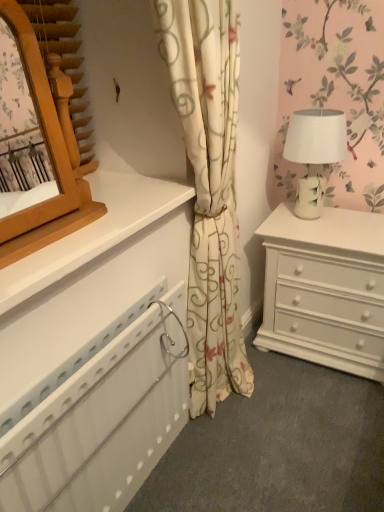
Question: Is white ceramic table lamp at right oriented away from white plastic radiator at lower left?

Choices:
 (A) yes
 (B) no

Answer: (B)

Question: Is white plastic radiator at lower left a part of white ceramic table lamp at right?

Choices:
 (A) no
 (B) yes

Answer: (A)

Question: Is white ceramic table lamp at right closer to the viewer compared to white plastic radiator at lower left?

Choices:
 (A) yes
 (B) no

Answer: (B)

Question: From the image's perspective, is white ceramic table lamp at right located beneath white plastic radiator at lower left?

Choices:
 (A) no
 (B) yes

Answer: (A)

Question: Considering the relative sizes of white ceramic table lamp at right and white plastic radiator at lower left in the image provided, is white ceramic table lamp at right shorter than white plastic radiator at lower left?

Choices:
 (A) no
 (B) yes

Answer: (B)

Question: Considering their positions, is white ceramic table lamp at right located in front of or behind wooden mirror at upper left?

Choices:
 (A) front
 (B) behind

Answer: (B)

Question: From a real-world perspective, is white ceramic table lamp at right physically located above or below wooden mirror at upper left?

Choices:
 (A) below
 (B) above

Answer: (A)

Question: From the image's perspective, relative to wooden mirror at upper left, is white ceramic table lamp at right above or below?

Choices:
 (A) above
 (B) below

Answer: (A)

Question: Is white ceramic table lamp at right wider or thinner than wooden mirror at upper left?

Choices:
 (A) thin
 (B) wide

Answer: (B)

Question: Is white floral curtain at center to the left or to the right of white plastic radiator at lower left in the image?

Choices:
 (A) right
 (B) left

Answer: (A)

Question: Is white floral curtain at center wider or thinner than white plastic radiator at lower left?

Choices:
 (A) thin
 (B) wide

Answer: (B)

Question: Which is correct: white floral curtain at center is inside white plastic radiator at lower left, or outside of it?

Choices:
 (A) outside
 (B) inside

Answer: (A)

Question: Is white floral curtain at center in front of or behind white plastic radiator at lower left in the image?

Choices:
 (A) front
 (B) behind

Answer: (B)

Question: From the image's perspective, is white plastic radiator at lower left located above or below white ceramic table lamp at right?

Choices:
 (A) below
 (B) above

Answer: (A)

Question: Would you say white plastic radiator at lower left is inside or outside white ceramic table lamp at right?

Choices:
 (A) inside
 (B) outside

Answer: (B)